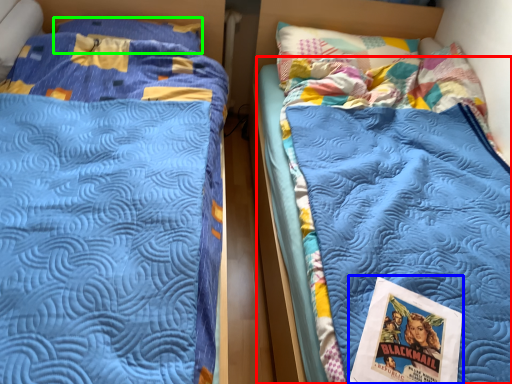
Question: Considering the real-world distances, which object is farthest from mattress (highlighted by a red box)? comic book (highlighted by a blue box) or pillow (highlighted by a green box)?

Choices:
 (A) comic book
 (B) pillow

Answer: (B)